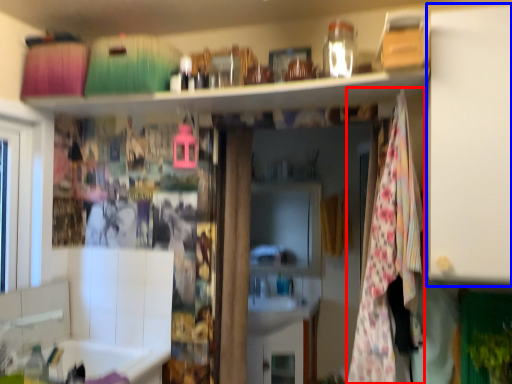
Question: Which object is closer to the camera taking this photo, blanket (highlighted by a red box) or cabinet (highlighted by a blue box)?

Choices:
 (A) blanket
 (B) cabinet

Answer: (B)